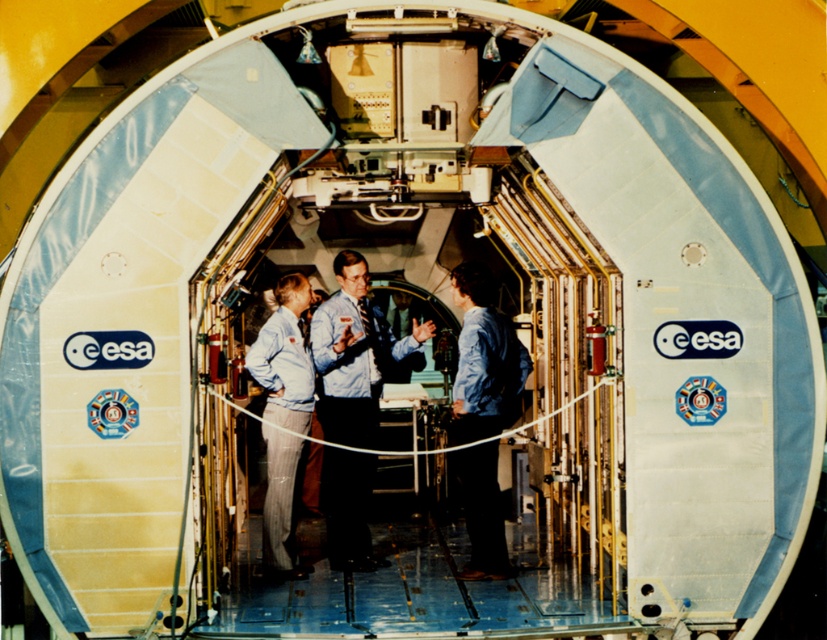
Can you confirm if blue shirt at center is wider than blue denim shirt at center?

Yes.

Can you confirm if blue shirt at center is positioned to the left of blue denim shirt at center?

Correct, you'll find blue shirt at center to the left of blue denim shirt at center.

In the scene shown: Who is more distant from viewer, (338, 476) or (486, 413)?

Positioned behind is point (338, 476).

You are a GUI agent. You are given a task and a screenshot of the screen. Output one action in this format:
    pyautogui.click(x=<x>, y=<y>)
    Task: Click on the blue shirt at center
    
    Given the screenshot: What is the action you would take?
    pyautogui.click(x=354, y=353)

Does point (491, 452) come in front of point (302, 374)?

No.

Who is shorter, blue denim shirt at center or light blue fabric pants at center?

With less height is light blue fabric pants at center.

In order to click on blue denim shirt at center in this screenshot , I will do `click(484, 358)`.

Measure the distance between point (x=336, y=304) and camera.

36.27 feet

Who is more forward, (366, 532) or (295, 436)?

Point (295, 436) is in front.

Identify the location of blue shirt at center. The image size is (827, 640). (354, 353).